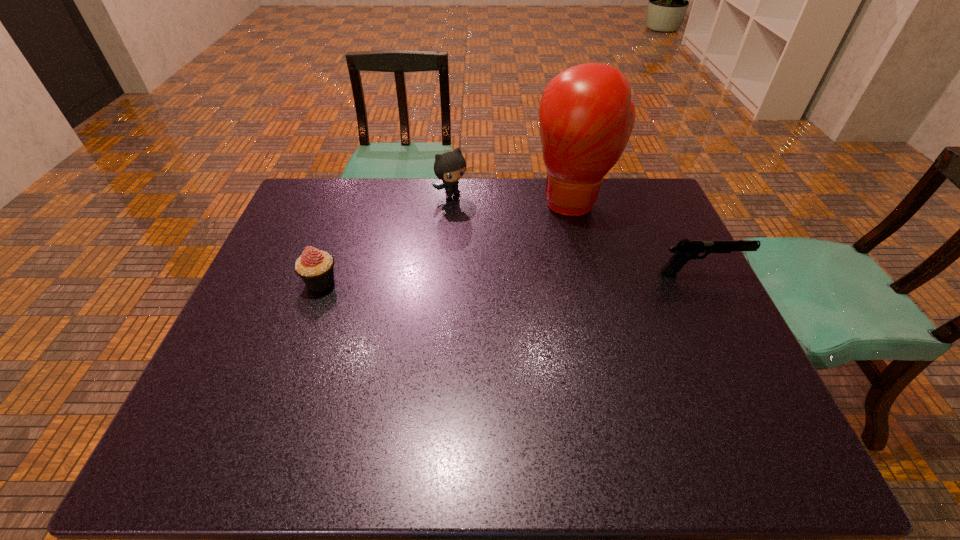
Where is `free spot located on the striking surface of the tallest object`? The width and height of the screenshot is (960, 540). free spot located on the striking surface of the tallest object is located at coordinates (570, 240).

You are a GUI agent. You are given a task and a screenshot of the screen. Output one action in this format:
    pyautogui.click(x=<x>, y=<y>)
    Task: Click on the free space located on the striking surface of the tallest object
    The image size is (960, 540).
    Given the screenshot: What is the action you would take?
    pyautogui.click(x=567, y=275)

This screenshot has height=540, width=960. I want to click on free space located on the striking surface of the tallest object, so [569, 253].

Locate an element on the screen. kitten present at the far edge is located at coordinates (449, 167).

You are a GUI agent. You are given a task and a screenshot of the screen. Output one action in this format:
    pyautogui.click(x=<x>, y=<y>)
    Task: Click on the boxing glove positioned at the far edge
    
    Given the screenshot: What is the action you would take?
    pyautogui.click(x=586, y=116)

The image size is (960, 540). Identify the location of object that is at the left edge. (316, 268).

You are a GUI agent. You are given a task and a screenshot of the screen. Output one action in this format:
    pyautogui.click(x=<x>, y=<y>)
    Task: Click on the gun located in the right edge section of the desktop
    The image size is (960, 540).
    Given the screenshot: What is the action you would take?
    pyautogui.click(x=685, y=250)

This screenshot has height=540, width=960. I want to click on boxing glove at the right edge, so click(x=586, y=116).

I want to click on object at the far right corner, so click(586, 116).

Find the location of a particular element. The width and height of the screenshot is (960, 540). free region at the far edge of the desktop is located at coordinates point(530,192).